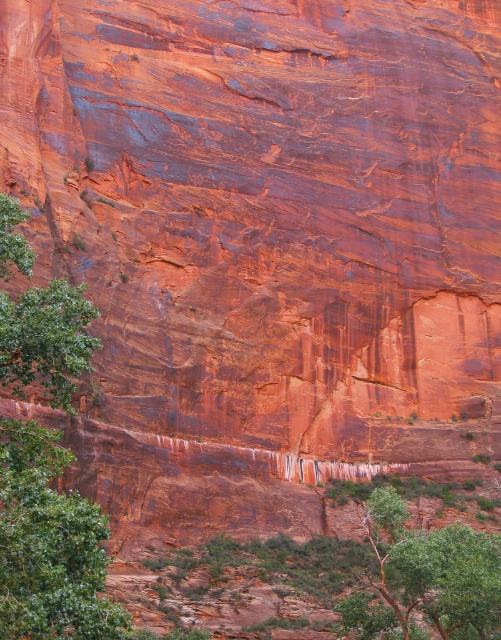
Which of these two, green leafy tree at left or green leafy tree at lower center, stands shorter?

green leafy tree at lower center

Is green leafy tree at left to the right of green leafy tree at lower center from the viewer's perspective?

Incorrect, green leafy tree at left is not on the right side of green leafy tree at lower center.

Is point (97, 563) behind point (422, 605)?

No, (97, 563) is in front of (422, 605).

At what (x,y) coordinates should I click in order to perform the action: click on green leafy tree at left. Please return your answer as a coordinate pair (x, y). The width and height of the screenshot is (501, 640). Looking at the image, I should click on (49, 545).